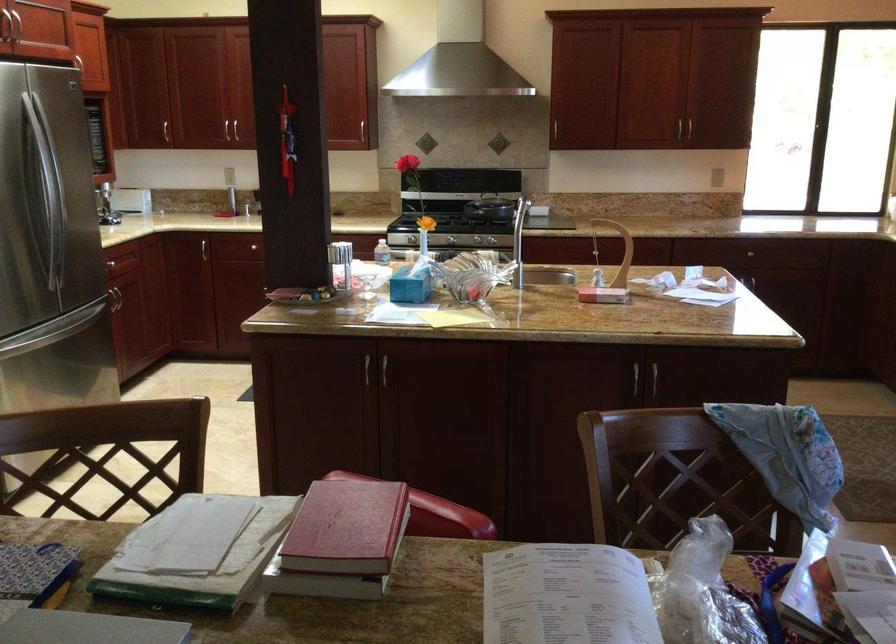
Find where to pull the refrigerator door handle. Please return your answer as a coordinate pair (x, y).

(50, 199)